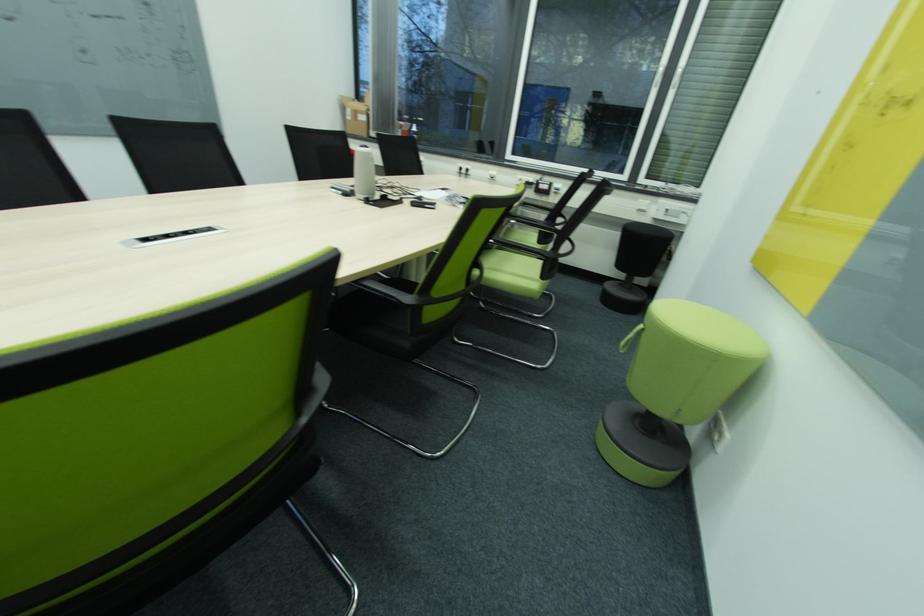
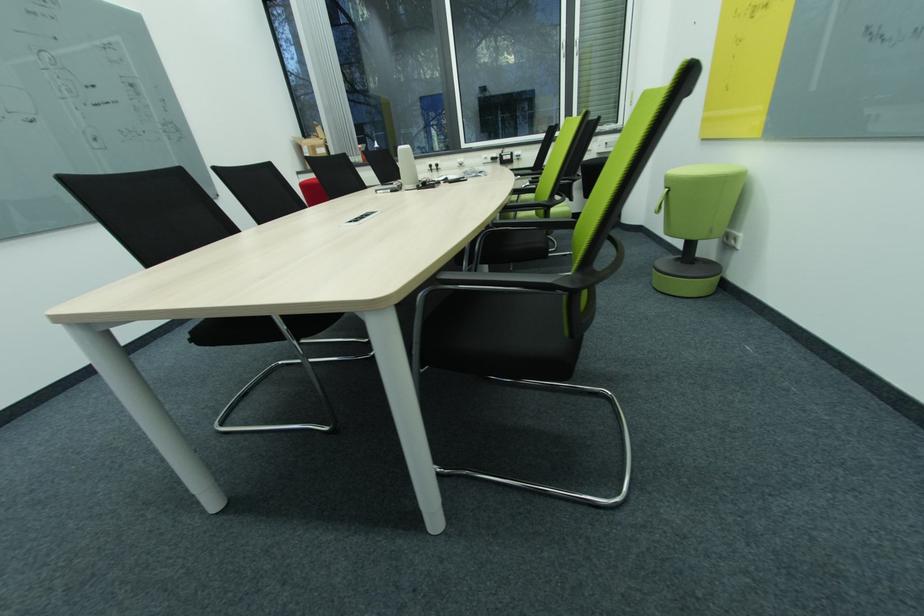
Question: What movement of the cameraman would produce the second image?

Choices:
 (A) Left
 (B) Right
 (C) Forward
 (D) Backward

Answer: (A)